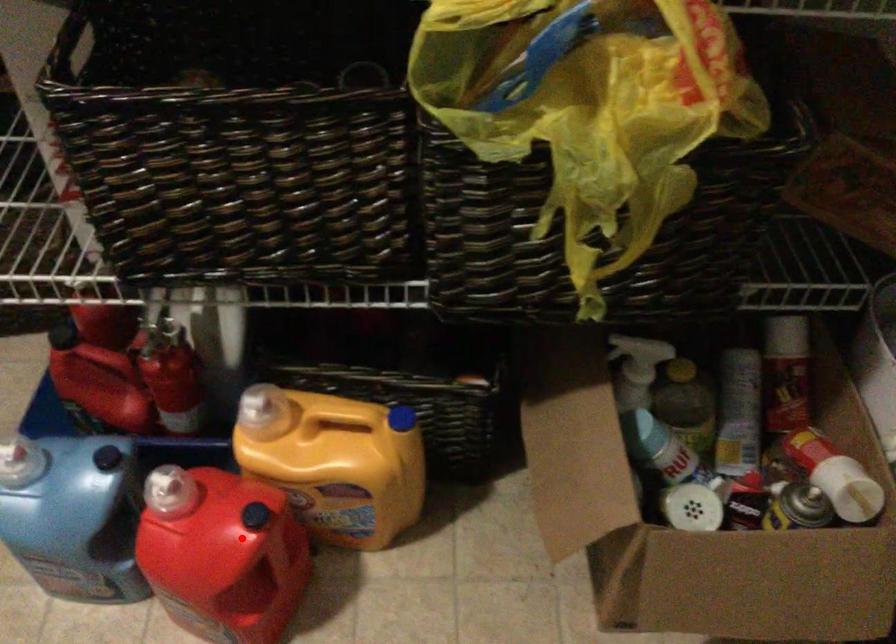
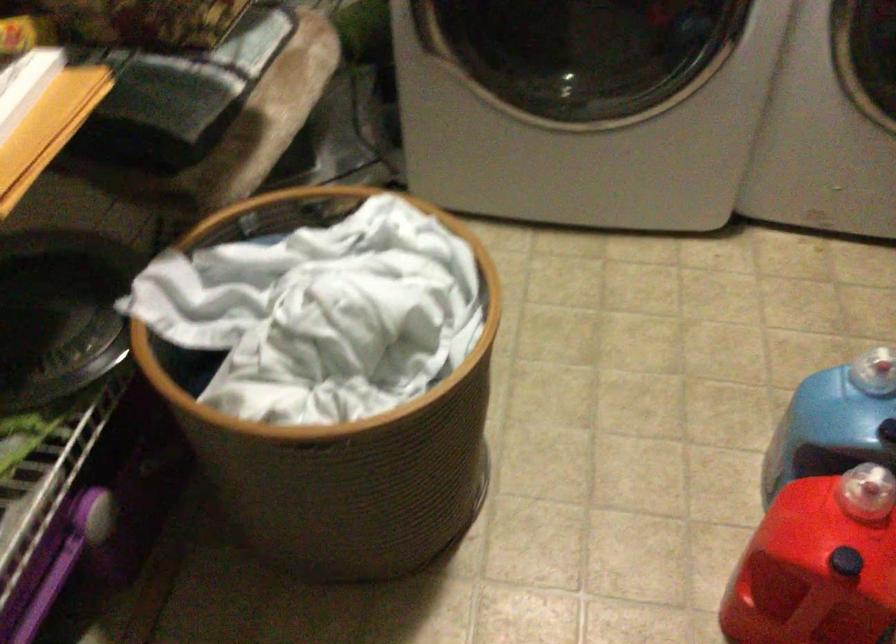
Question: A red point is marked in image1. In image2, is the corresponding 3D point closer to the camera or farther? Reply with the corresponding letter.

Choices:
 (A) The corresponding 3D point is closer.
 (B) The corresponding 3D point is farther.

Answer: (A)